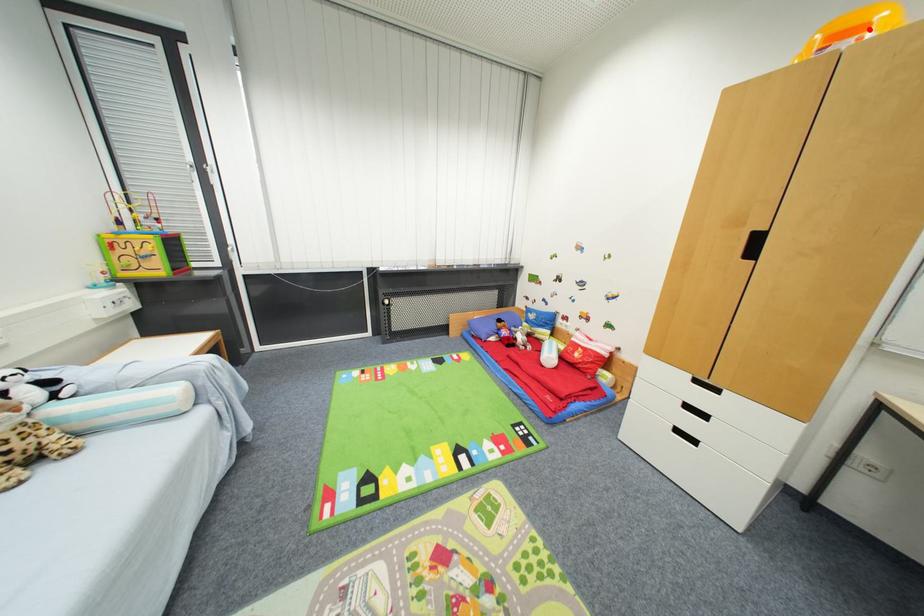
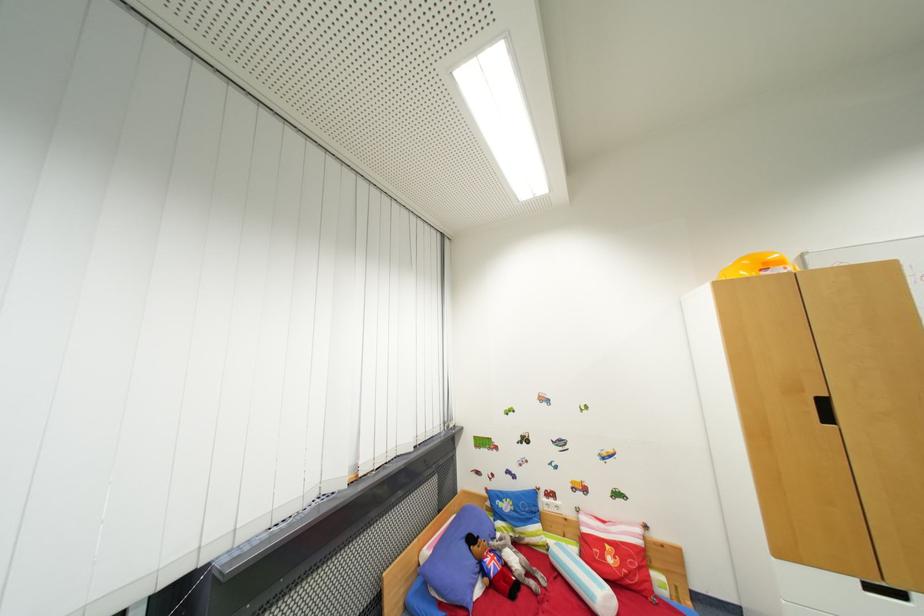
Question: I am providing you with two images of the same scene from different viewpoints. A red point is marked on the first image. Is the red point's position out of view in image 2?

Choices:
 (A) Yes
 (B) No

Answer: (B)